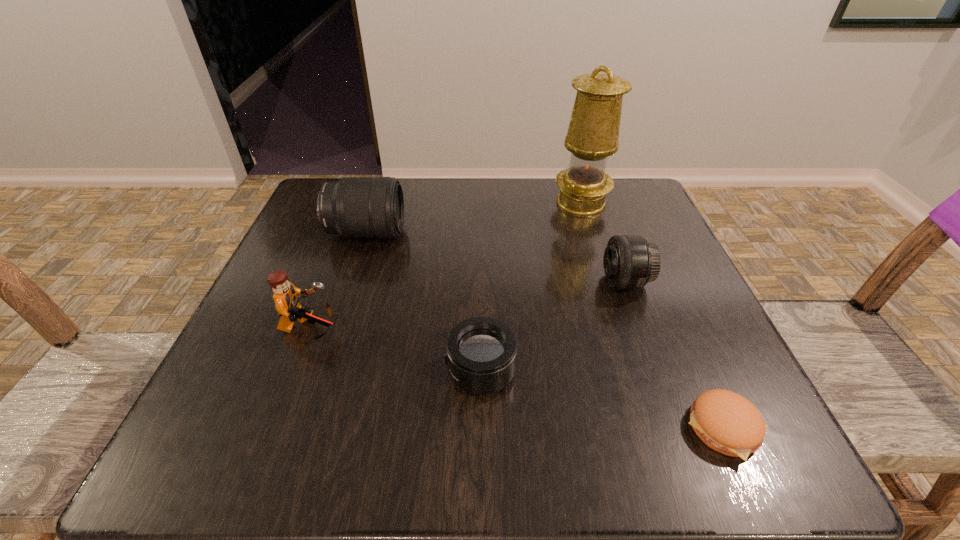
The image size is (960, 540). Find the location of `free space located 0.130m on the surface of the tallest telephoto lens`. free space located 0.130m on the surface of the tallest telephoto lens is located at coordinates (465, 233).

Image resolution: width=960 pixels, height=540 pixels. In order to click on vacant space located holding a crossbow in the hands of the Lego in this screenshot , I will do `click(484, 329)`.

Locate an element on the screen. Image resolution: width=960 pixels, height=540 pixels. free space located 0.300m on the front-facing side of the rightmost telephoto lens is located at coordinates (442, 282).

What are the coordinates of `vacant space situated on the front-facing side of the rightmost telephoto lens` in the screenshot? It's located at (415, 282).

You are a GUI agent. You are given a task and a screenshot of the screen. Output one action in this format:
    pyautogui.click(x=<x>, y=<y>)
    Task: Click on the vacant point located on the front-facing side of the rightmost telephoto lens
    
    Given the screenshot: What is the action you would take?
    pyautogui.click(x=560, y=282)

This screenshot has height=540, width=960. What are the coordinates of `free point located 0.240m on the side of the second shortest object with brand markings and control switches` in the screenshot? It's located at (289, 370).

You are a GUI agent. You are given a task and a screenshot of the screen. Output one action in this format:
    pyautogui.click(x=<x>, y=<y>)
    Task: Click on the blank area located on the side of the second shortest object with brand markings and control switches
    
    Given the screenshot: What is the action you would take?
    pyautogui.click(x=328, y=370)

The height and width of the screenshot is (540, 960). In order to click on free region located 0.260m on the side of the second shortest object with brand markings and control switches in this screenshot , I will do click(x=276, y=370).

At what (x,y) coordinates should I click in order to perform the action: click on vacant position located on the back of the patty. Please return your answer as a coordinate pair (x, y). Looking at the image, I should click on (669, 306).

The image size is (960, 540). I want to click on oil lamp that is positioned at the far edge, so click(x=593, y=132).